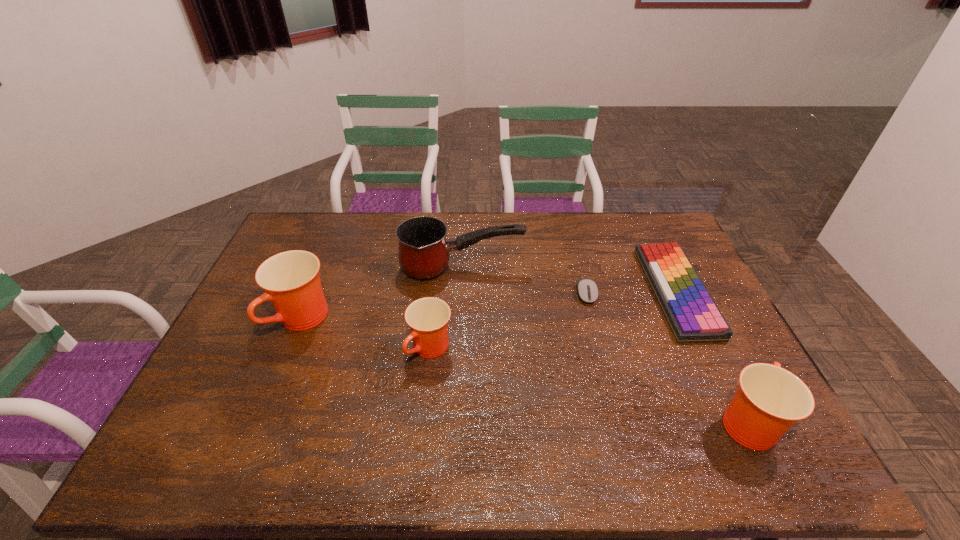
The image size is (960, 540). In order to click on vacant point located on the right of the fourth tallest object in this screenshot , I will do `click(577, 349)`.

This screenshot has width=960, height=540. Identify the location of free space located on the left of the second shortest cup. (563, 421).

What are the coordinates of `free region located 0.290m on the handle side of the saucepan` in the screenshot? It's located at (x=609, y=268).

Image resolution: width=960 pixels, height=540 pixels. What are the coordinates of `free space located 0.160m on the back of the computer keyboard` in the screenshot? It's located at (644, 225).

Locate an element on the screen. vacant space located 0.290m on the wheel side of the shortest object is located at coordinates (610, 385).

Locate an element on the screen. The width and height of the screenshot is (960, 540). object situated at the far edge is located at coordinates (690, 311).

In order to click on object at the near edge in this screenshot , I will do `click(769, 400)`.

Find the location of `object situated at the left edge`. object situated at the left edge is located at coordinates (291, 280).

Where is `cup that is at the right edge`? The height and width of the screenshot is (540, 960). cup that is at the right edge is located at coordinates (769, 400).

Locate an element on the screen. The image size is (960, 540). computer keyboard that is at the right edge is located at coordinates click(x=690, y=311).